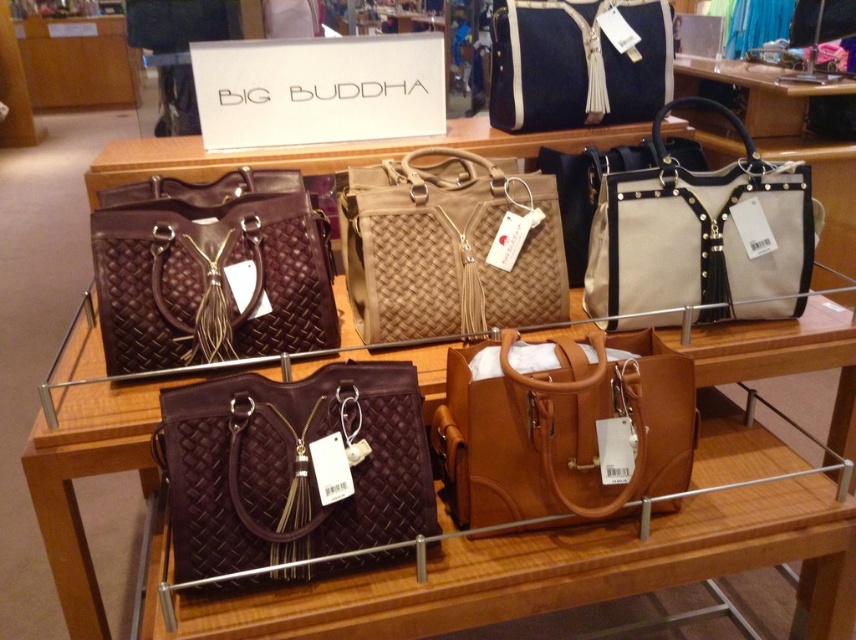
Can you confirm if matte purple woven handbag at lower center is thinner than brown woven handbag at upper left?

In fact, matte purple woven handbag at lower center might be wider than brown woven handbag at upper left.

Is point (270, 394) more distant than point (107, 324)?

No, it is in front of (107, 324).

Where is `matte purple woven handbag at lower center`? Image resolution: width=856 pixels, height=640 pixels. matte purple woven handbag at lower center is located at coordinates (290, 467).

Can you confirm if tan leather handbag at center is bigger than beige canvas tote at upper right?

Incorrect, tan leather handbag at center is not larger than beige canvas tote at upper right.

Between point (516, 433) and point (645, 288), which one is positioned in front?

Point (516, 433) is in front.

The height and width of the screenshot is (640, 856). What do you see at coordinates (563, 428) in the screenshot?
I see `tan leather handbag at center` at bounding box center [563, 428].

Identify the location of tan leather handbag at center. (563, 428).

This screenshot has height=640, width=856. Describe the element at coordinates (211, 269) in the screenshot. I see `brown woven handbag at upper left` at that location.

Measure the distance between point [321,269] and camera.

Point [321,269] is 1.37 meters away from camera.

Where is `brown woven handbag at upper left`? Image resolution: width=856 pixels, height=640 pixels. brown woven handbag at upper left is located at coordinates (211, 269).